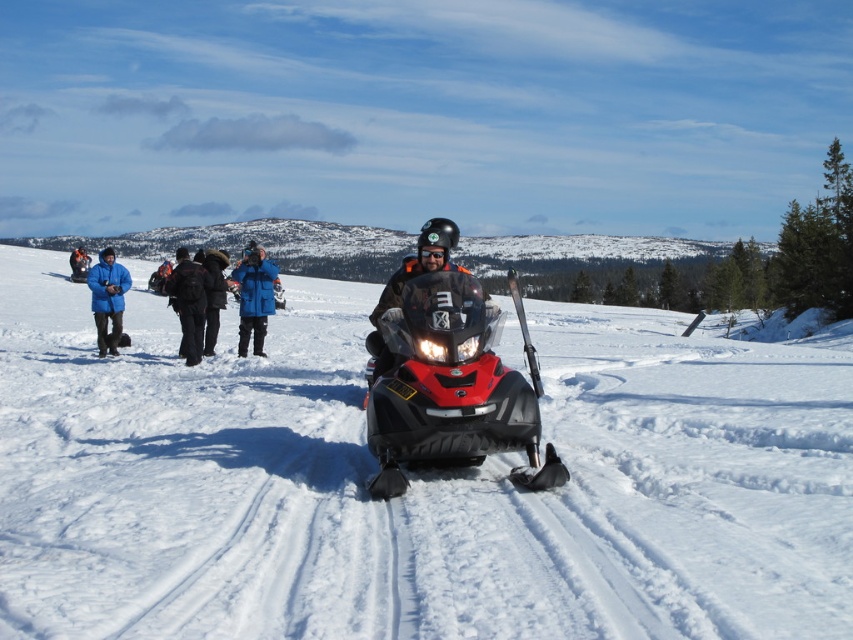
Does shiny red plastic snowmobile at center appear on the right side of black backpack at center?

Indeed, shiny red plastic snowmobile at center is positioned on the right side of black backpack at center.

Is shiny red plastic snowmobile at center positioned in front of black backpack at center?

Yes, shiny red plastic snowmobile at center is in front of black backpack at center.

Does point (463, 337) lie in front of point (169, 298)?

Yes, point (463, 337) is closer to viewer.

Locate an element on the screen. Image resolution: width=853 pixels, height=640 pixels. shiny red plastic snowmobile at center is located at coordinates (453, 387).

How distant is shiny black snowmobile at center from black matte goggles at center?

shiny black snowmobile at center and black matte goggles at center are 39.05 inches apart.

Is shiny black snowmobile at center thinner than black matte goggles at center?

No, shiny black snowmobile at center is not thinner than black matte goggles at center.

Is point (383, 307) farther from camera compared to point (428, 256)?

Yes, point (383, 307) is behind point (428, 256).

At what (x,y) coordinates should I click in order to perform the action: click on shiny black snowmobile at center. Please return your answer as a coordinate pair (x, y). The image size is (853, 640). Looking at the image, I should click on (418, 262).

Which of these two, blue fabric jacket at center or black matte goggles at center, stands taller?

With more height is blue fabric jacket at center.

Image resolution: width=853 pixels, height=640 pixels. I want to click on blue fabric jacket at center, so click(x=254, y=296).

Find the location of a particular element. Image resolution: width=853 pixels, height=640 pixels. blue fabric jacket at center is located at coordinates (254, 296).